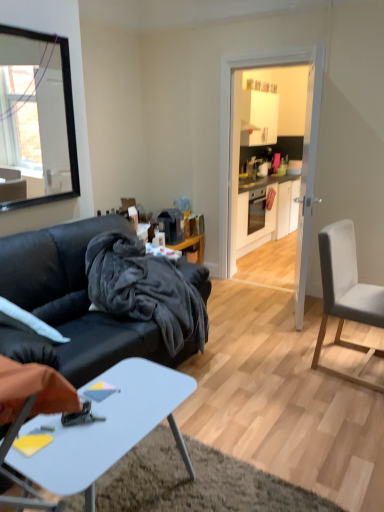
At what (x,y) coordinates should I click in order to perform the action: click on vacant point above white glossy door at center (from a real-world perspective). Please return your answer as a coordinate pair (x, y). The height and width of the screenshot is (512, 384). Looking at the image, I should click on (268, 47).